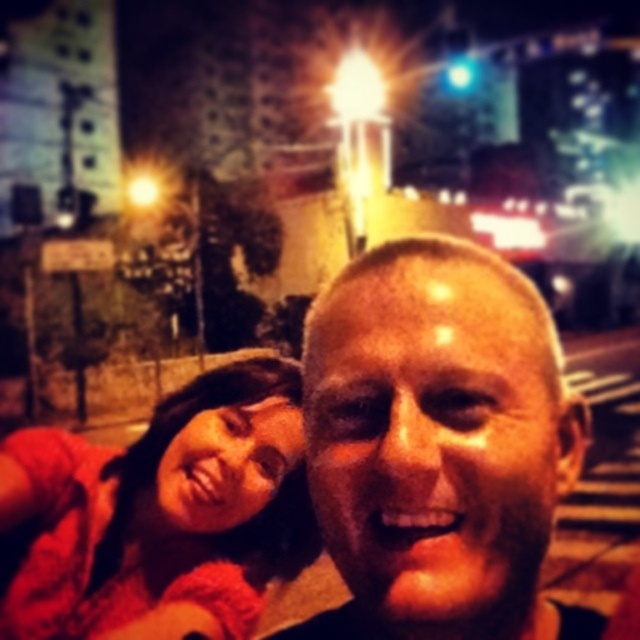
Question: Is smooth skin face at center to the right of matte red shirt at lower left from the viewer's perspective?

Choices:
 (A) yes
 (B) no

Answer: (A)

Question: Which point is farther to the camera?

Choices:
 (A) coord(467,305)
 (B) coord(80,548)

Answer: (B)

Question: Is smooth skin face at center in front of matte red shirt at lower left?

Choices:
 (A) yes
 (B) no

Answer: (A)

Question: From the image, what is the correct spatial relationship of smooth skin face at center in relation to matte red shirt at lower left?

Choices:
 (A) above
 (B) below

Answer: (A)

Question: Which of the following is the farthest from the observer?

Choices:
 (A) smooth skin face at center
 (B) matte red shirt at lower left

Answer: (B)

Question: Among these objects, which one is nearest to the camera?

Choices:
 (A) matte red shirt at lower left
 (B) smooth skin face at center

Answer: (B)